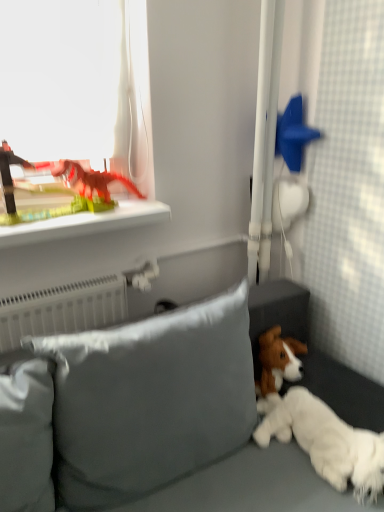
Question: From the image's perspective, is transparent plastic dinosaur at upper left over white fluffy dog at lower right?

Choices:
 (A) no
 (B) yes

Answer: (B)

Question: Is transparent plastic dinosaur at upper left located outside white fluffy dog at lower right?

Choices:
 (A) yes
 (B) no

Answer: (A)

Question: Is transparent plastic dinosaur at upper left wider than white fluffy dog at lower right?

Choices:
 (A) yes
 (B) no

Answer: (A)

Question: Is transparent plastic dinosaur at upper left thinner than white fluffy dog at lower right?

Choices:
 (A) no
 (B) yes

Answer: (A)

Question: Are transparent plastic dinosaur at upper left and white fluffy dog at lower right making contact?

Choices:
 (A) no
 (B) yes

Answer: (A)

Question: From the image's perspective, is transparent plastic dinosaur at upper left beneath white fluffy dog at lower right?

Choices:
 (A) yes
 (B) no

Answer: (B)

Question: From a real-world perspective, is matte plastic dinosaur at upper left, which is counted as the first toy, starting from the left, on top of satin gray pillow at lower center?

Choices:
 (A) no
 (B) yes

Answer: (B)

Question: Considering the relative sizes of matte plastic dinosaur at upper left, placed as the second toy when sorted from right to left, and satin gray pillow at lower center in the image provided, is matte plastic dinosaur at upper left, placed as the second toy when sorted from right to left, smaller than satin gray pillow at lower center?

Choices:
 (A) no
 (B) yes

Answer: (B)

Question: Does matte plastic dinosaur at upper left, which is counted as the first toy, starting from the left, appear on the right side of satin gray pillow at lower center?

Choices:
 (A) yes
 (B) no

Answer: (B)

Question: Are matte plastic dinosaur at upper left, placed as the second toy when sorted from right to left, and satin gray pillow at lower center located far from each other?

Choices:
 (A) yes
 (B) no

Answer: (B)

Question: Does matte plastic dinosaur at upper left, placed as the second toy when sorted from right to left, appear on the left side of satin gray pillow at lower center?

Choices:
 (A) no
 (B) yes

Answer: (B)

Question: Is matte plastic dinosaur at upper left, placed as the second toy when sorted from right to left, bigger than satin gray pillow at lower center?

Choices:
 (A) no
 (B) yes

Answer: (A)

Question: From the image's perspective, is matte plastic dinosaur at upper left, placed as the second toy when sorted from right to left, on white fluffy dog at lower right?

Choices:
 (A) yes
 (B) no

Answer: (A)